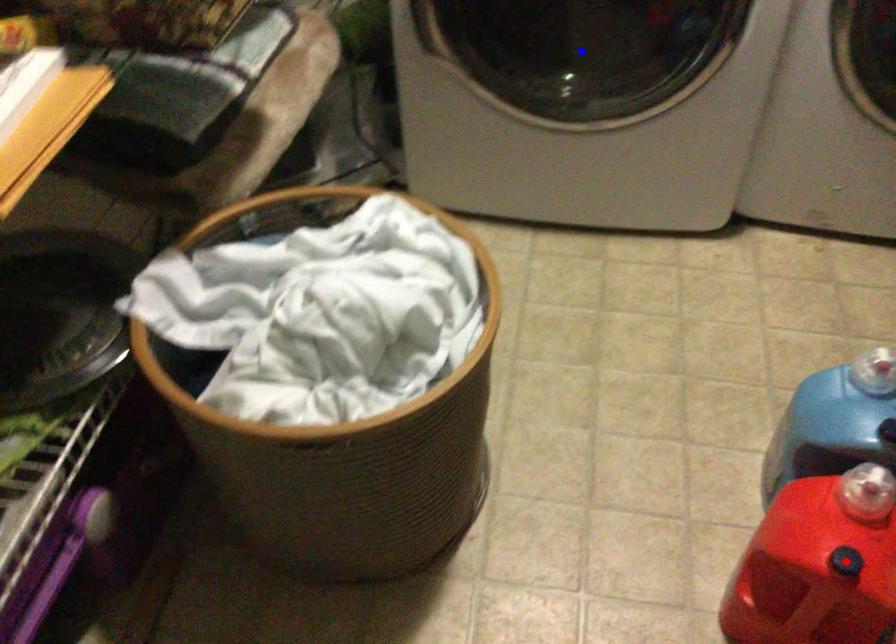
Question: In the image, two points are highlighted. Which point is nearer to the camera? Reply with the corresponding letter.

Choices:
 (A) blue point
 (B) red point

Answer: (B)